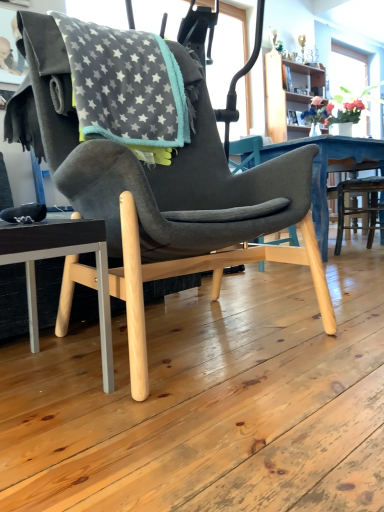
Question: Is point (31, 272) positioned closer to the camera than point (155, 84)?

Choices:
 (A) closer
 (B) farther

Answer: (A)

Question: Is matte black chair at lower left wider or thinner than gray fleece blanket at upper left?

Choices:
 (A) thin
 (B) wide

Answer: (A)

Question: Estimate the real-world distances between objects in this image. Which object is closer to the matte black chair at lower left?

Choices:
 (A) wooden bookshelf at upper right
 (B) gray fleece blanket at upper left

Answer: (B)

Question: Estimate the real-world distances between objects in this image. Which object is farther from the gray fleece blanket at upper left?

Choices:
 (A) wooden bookshelf at upper right
 (B) matte black chair at lower left

Answer: (A)